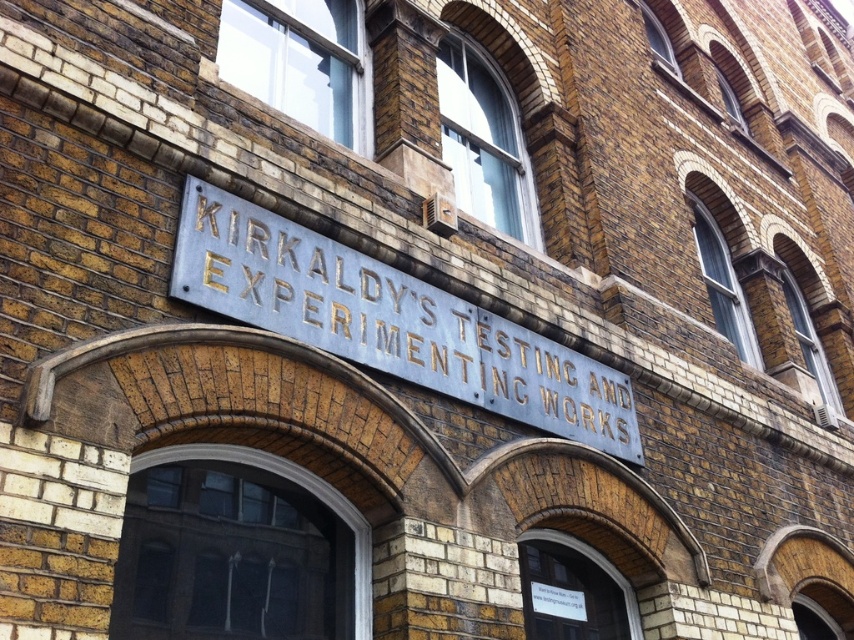
You are a painter who needs to cover the entire surface of the silver metallic sign at center and the white paper sign at lower center. Which sign requires more paint? Please explain your reasoning based on their sizes.

The silver metallic sign at center might require more paint than the white paper sign at lower center because it might be wider, which could mean it has a larger surface area.

Looking at the white paper sign at lower center and the white plastic sign at center, which one is taller?

The white paper sign at lower center is taller than the white plastic sign at center.

You are a delivery person trying to read the signs on the brick building. You notice two signs, the white paper sign at lower center and the white plastic sign at center. Which one is larger?

The white paper sign at lower center is bigger than the white plastic sign at center.